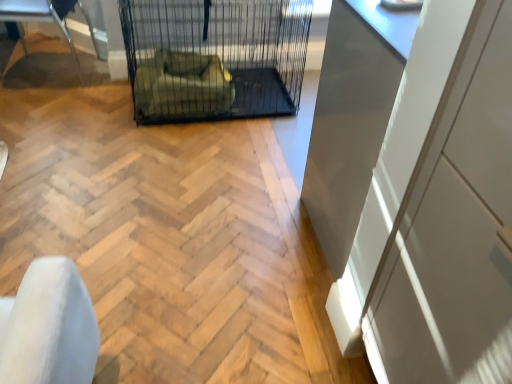
At what (x,y) coordinates should I click in order to perform the action: click on free space in front of black wire mesh cage at center. Please return your answer as a coordinate pair (x, y). Looking at the image, I should click on (170, 172).